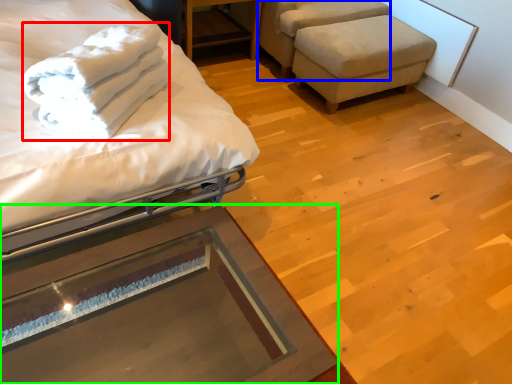
Question: Which is nearer to the bath towel (highlighted by a red box)? swivel chair (highlighted by a blue box) or table (highlighted by a green box).

Choices:
 (A) swivel chair
 (B) table

Answer: (B)